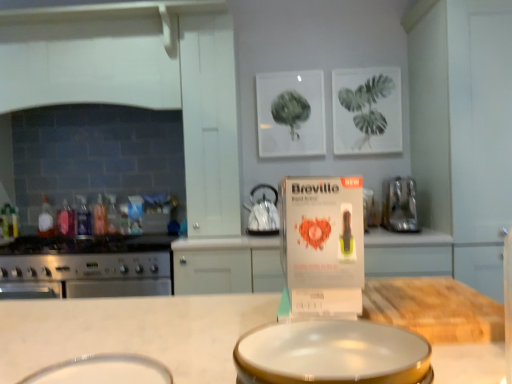
Question: In the image, is translucent plastic bottle at left, placed as the first bottle when sorted from left to right, positioned in front of or behind white glossy basin at center, marked as the first basin in a right-to-left arrangement?

Choices:
 (A) behind
 (B) front

Answer: (A)

Question: Considering the positions of translucent plastic bottle at left, which is the fifth bottle from right to left, and white glossy basin at center, placed as the 2th basin when sorted from left to right, in the image, is translucent plastic bottle at left, which is the fifth bottle from right to left, wider or thinner than white glossy basin at center, placed as the 2th basin when sorted from left to right,?

Choices:
 (A) wide
 (B) thin

Answer: (B)

Question: Estimate the real-world distances between objects in this image. Which object is farther from the white glossy basin at center, placed as the 2th basin when sorted from left to right?

Choices:
 (A) white glossy basin at lower center, which ranks as the first basin in left-to-right order
 (B) translucent plastic bottle at left, positioned as the 4th bottle in right-to-left order
 (C) stainless steel oven at left, the 1th kitchen appliance viewed from the left
 (D) translucent plastic bottle at stove left, marked as the 4th bottle in a left-to-right arrangement
 (E) satin black kettle at center, which is counted as the 2th kitchen appliance, starting from the left

Answer: (B)

Question: Estimate the real-world distances between objects in this image. Which object is closer to the white glossy basin at center, marked as the first basin in a right-to-left arrangement?

Choices:
 (A) satin silver toaster at right, which is counted as the first kitchen appliance, starting from the right
 (B) translucent plastic bottle at left, placed as the first bottle when sorted from left to right
 (C) translucent plastic bottle at stove left, which is the 2th bottle in right-to-left order
 (D) stainless steel oven at left, the 1th kitchen appliance viewed from the left
 (E) translucent plastic bottle at stove left, the 3th bottle in the right-to-left sequence

Answer: (A)